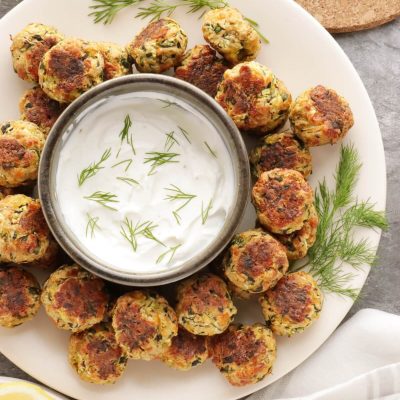
Where is `sauce bowl`? Image resolution: width=400 pixels, height=400 pixels. sauce bowl is located at coordinates (210, 258).